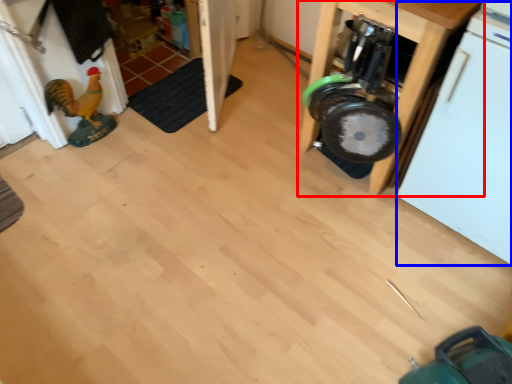
Question: Among these objects, which one is nearest to the camera, furniture (highlighted by a red box) or dish washer (highlighted by a blue box)?

Choices:
 (A) furniture
 (B) dish washer

Answer: (B)